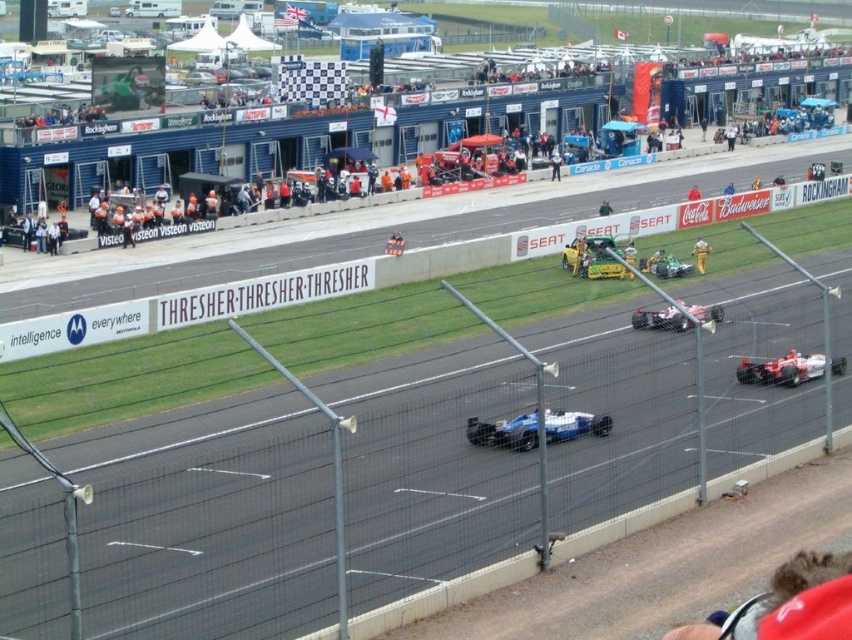
You are a photographer positioned at the edge of the track. You want to take a photo of the khaki fabric pants at center without the black asphalt race track at center appearing in the foreground. Is this possible?

The black asphalt race track at center is closer to the viewer than the khaki fabric pants at center, so the track would block the view of the pants in the foreground. Therefore, it is not possible to take a photo of the khaki fabric pants at center without the black asphalt race track at center appearing in the foreground.

You are a drone operator assigned to capture aerial footage of the Formula One race. The director wants the green matte race car at center to be the focal point. Given its coordinates at point 0.416, 0.784, where should you position the drone to ensure the car is centered in the frame?

To center the green matte race car at center in the frame, position the drone so that the car is located at the coordinates (666, 266), which places it exactly at the center of the image.

You are a photographer at the motorsport event. You want to capture a wide shot of the black asphalt race track at center and the khaki fabric pants at center. Which object will occupy more space in your photo?

The black asphalt race track at center is bigger than khaki fabric pants at center, so it will occupy more space in the photo.